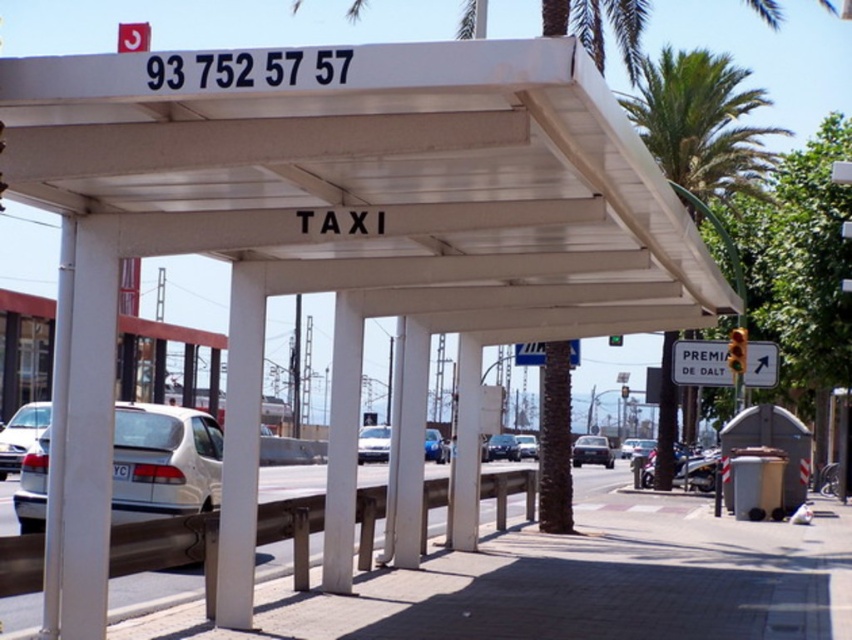
You are a pedestrian waiting at the taxi stand. You see a matte silver sedan at center and a white plastic sign at center. Which object is closer to you?

The matte silver sedan at center is closer to you because the white plastic sign at center is behind it.

You are a pedestrian standing at the taxi stand and want to hail a taxi. There is a white plastic sign at upper right and a shiny silver sedan at center. Which object is positioned higher relative to the other?

The white plastic sign at upper right is located above the shiny silver sedan at center, so the white plastic sign at upper right is higher than the shiny silver sedan at center.

You are a pedestrian standing at the taxi stand and want to read the white plastic sign at upper right. Is the matte silver sedan at center blocking your view of the sign?

The white plastic sign at upper right is in front of the matte silver sedan at center, so the sedan is not blocking the view of the sign.